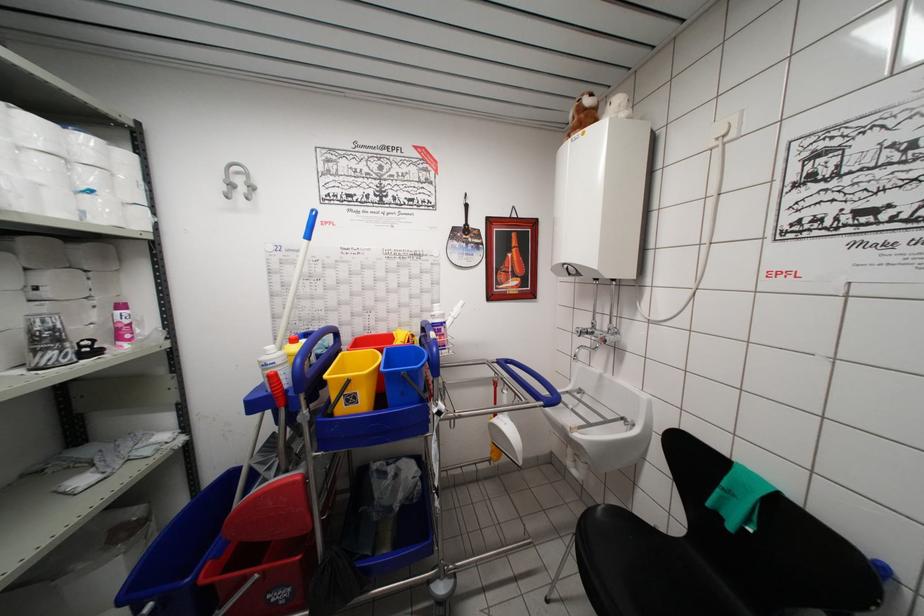
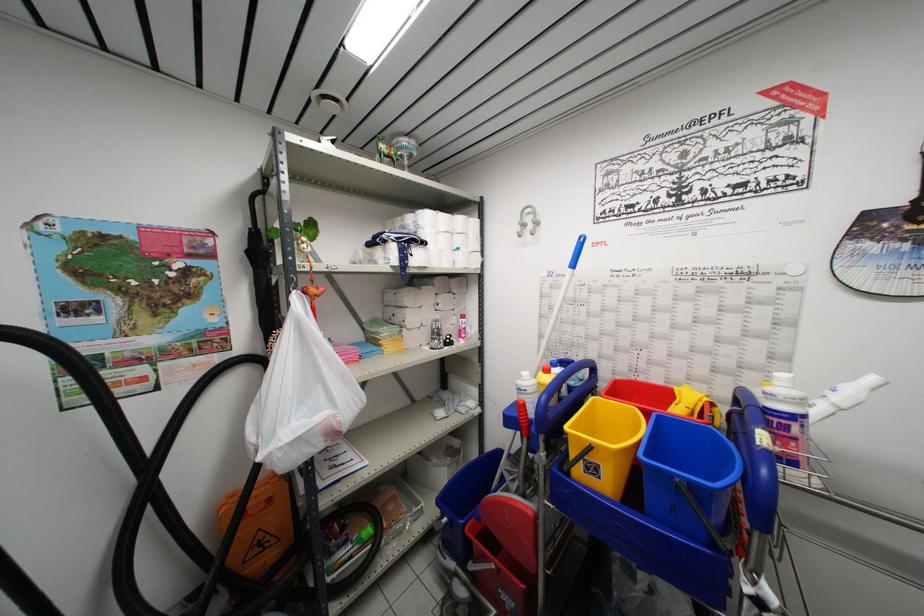
Locate, in the second image, the point that corresponds to (x=403, y=377) in the first image.

(675, 479)